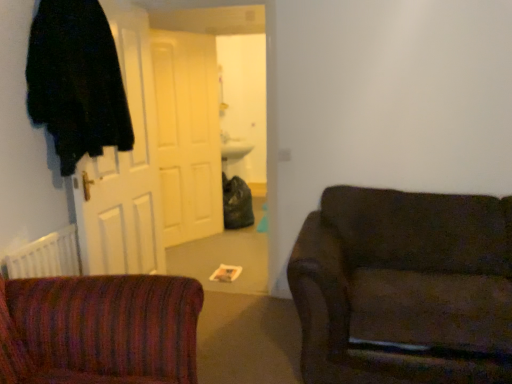
Locate an element on the screen. white wooden door at left, the second door in the back-to-front sequence is located at coordinates (124, 168).

What do you see at coordinates (187, 134) in the screenshot? Image resolution: width=512 pixels, height=384 pixels. I see `white matte door at center, which is the 2th door from front to back` at bounding box center [187, 134].

What is the approximate height of black fuzzy robe at left?

The height of black fuzzy robe at left is 36.57 inches.

Find the location of a particular element. white wooden door at left, positioned as the 1th door in front-to-back order is located at coordinates (124, 168).

Which of these two, dark brown fabric couch at right or white wooden door at left, the second door in the back-to-front sequence, is thinner?

white wooden door at left, the second door in the back-to-front sequence, is thinner.

Is dark brown fabric couch at right positioned with its back to white wooden door at left, the second door in the back-to-front sequence?

No, dark brown fabric couch at right's orientation is not away from white wooden door at left, the second door in the back-to-front sequence.

Is dark brown fabric couch at right with white wooden door at left, positioned as the 1th door in front-to-back order?

No, dark brown fabric couch at right is not touching white wooden door at left, positioned as the 1th door in front-to-back order.

Between dark brown fabric couch at right and white wooden door at left, the second door in the back-to-front sequence, which one has larger size?

Bigger between the two is dark brown fabric couch at right.

Considering the sizes of objects white wooden door at left, positioned as the 1th door in front-to-back order, and dark brown fabric couch at right in the image provided, who is shorter, white wooden door at left, positioned as the 1th door in front-to-back order, or dark brown fabric couch at right?

dark brown fabric couch at right is shorter.

Which object is wider, white wooden door at left, positioned as the 1th door in front-to-back order, or dark brown fabric couch at right?

Wider between the two is dark brown fabric couch at right.

Is white wooden door at left, the second door in the back-to-front sequence, in contact with dark brown fabric couch at right?

No.

Which object is closer to the camera taking this photo, white wooden door at left, positioned as the 1th door in front-to-back order, or dark brown fabric couch at right?

dark brown fabric couch at right.

Is black fuzzy robe at left at the left side of white wooden door at left, positioned as the 1th door in front-to-back order?

Indeed, black fuzzy robe at left is positioned on the left side of white wooden door at left, positioned as the 1th door in front-to-back order.

Is black fuzzy robe at left positioned with its back to white wooden door at left, positioned as the 1th door in front-to-back order?

Correct, black fuzzy robe at left is looking away from white wooden door at left, positioned as the 1th door in front-to-back order.

How distant is black fuzzy robe at left from white wooden door at left, the second door in the back-to-front sequence?

black fuzzy robe at left is 15.91 inches away from white wooden door at left, the second door in the back-to-front sequence.

Looking at their sizes, would you say black fuzzy robe at left is wider or thinner than white wooden door at left, the second door in the back-to-front sequence?

In the image, black fuzzy robe at left appears to be wider than white wooden door at left, the second door in the back-to-front sequence.

From a real-world perspective, who is located higher, black fuzzy robe at left or dark brown fabric couch at right?

black fuzzy robe at left is physically above.

In the scene shown: Between black fuzzy robe at left and dark brown fabric couch at right, which one has smaller width?

Thinner between the two is black fuzzy robe at left.

From the image's perspective, would you say black fuzzy robe at left is positioned over dark brown fabric couch at right?

Indeed, from the image's perspective, black fuzzy robe at left is shown above dark brown fabric couch at right.

Considering the relative positions of black fuzzy robe at left and dark brown fabric couch at right in the image provided, is black fuzzy robe at left to the right of dark brown fabric couch at right from the viewer's perspective?

No.

In the scene shown: Are dark brown fabric couch at right and white matte door at center, which is the first door from back to front, far apart?

dark brown fabric couch at right is far away from white matte door at center, which is the first door from back to front.

Considering the sizes of dark brown fabric couch at right and white matte door at center, which is the 2th door from front to back, in the image, is dark brown fabric couch at right wider or thinner than white matte door at center, which is the 2th door from front to back,?

Clearly, dark brown fabric couch at right has more width compared to white matte door at center, which is the 2th door from front to back.

Between point (358, 196) and point (202, 132), which one is positioned in front?

The point (358, 196) is more forward.

From the image's perspective, relative to white matte door at center, which is the first door from back to front, is white wooden door at left, the second door in the back-to-front sequence, above or below?

Clearly, from the image's perspective, white wooden door at left, the second door in the back-to-front sequence, is below white matte door at center, which is the first door from back to front.

Which of these two, white wooden door at left, the second door in the back-to-front sequence, or white matte door at center, which is the first door from back to front, is bigger?

white wooden door at left, the second door in the back-to-front sequence, is bigger.

Can we say white wooden door at left, the second door in the back-to-front sequence, lies outside white matte door at center, which is the first door from back to front?

That's correct, white wooden door at left, the second door in the back-to-front sequence, is outside of white matte door at center, which is the first door from back to front.

Can you confirm if white matte door at center, which is the 2th door from front to back, is taller than dark brown fabric couch at right?

Indeed, white matte door at center, which is the 2th door from front to back, has a greater height compared to dark brown fabric couch at right.

Which object is closer to the camera taking this photo, white matte door at center, which is the first door from back to front, or dark brown fabric couch at right?

dark brown fabric couch at right is closer to the camera.

The image size is (512, 384). I want to click on door that is the 1st one above the dark brown fabric couch at right (from a real-world perspective), so click(x=187, y=134).

Which object is positioned more to the left, white matte door at center, which is the 2th door from front to back, or dark brown fabric couch at right?

From the viewer's perspective, white matte door at center, which is the 2th door from front to back, appears more on the left side.

This screenshot has width=512, height=384. I want to click on the 1st door above when counting from the dark brown fabric couch at right (from the image's perspective), so click(124, 168).

Locate an element on the screen. This screenshot has width=512, height=384. studio couch in front of the white wooden door at left, the second door in the back-to-front sequence is located at coordinates (404, 288).

When comparing their distances from white wooden door at left, the second door in the back-to-front sequence, does dark brown fabric couch at right or white matte door at center, which is the first door from back to front, seem closer?

white matte door at center, which is the first door from back to front, lies closer to white wooden door at left, the second door in the back-to-front sequence, than the other object.

Estimate the real-world distances between objects in this image. Which object is closer to black fuzzy robe at left, white wooden door at left, positioned as the 1th door in front-to-back order, or dark brown fabric couch at right?

white wooden door at left, positioned as the 1th door in front-to-back order, is closer to black fuzzy robe at left.

When comparing their distances from black fuzzy robe at left, does dark brown fabric couch at right or white wooden door at left, the second door in the back-to-front sequence, seem further?

The object further to black fuzzy robe at left is dark brown fabric couch at right.

When comparing their distances from black fuzzy robe at left, does white matte door at center, which is the 2th door from front to back, or white wooden door at left, the second door in the back-to-front sequence, seem further?

white matte door at center, which is the 2th door from front to back, lies further to black fuzzy robe at left than the other object.

When comparing their distances from white matte door at center, which is the 2th door from front to back, does dark brown fabric couch at right or black fuzzy robe at left seem closer?

black fuzzy robe at left is closer to white matte door at center, which is the 2th door from front to back.

When comparing their distances from white matte door at center, which is the 2th door from front to back, does white wooden door at left, the second door in the back-to-front sequence, or dark brown fabric couch at right seem closer?

Among the two, white wooden door at left, the second door in the back-to-front sequence, is located nearer to white matte door at center, which is the 2th door from front to back.

Based on their spatial positions, is black fuzzy robe at left or white matte door at center, which is the first door from back to front, further from white wooden door at left, positioned as the 1th door in front-to-back order?

The object further to white wooden door at left, positioned as the 1th door in front-to-back order, is white matte door at center, which is the first door from back to front.

When comparing their distances from black fuzzy robe at left, does white wooden door at left, positioned as the 1th door in front-to-back order, or white matte door at center, which is the 2th door from front to back, seem closer?

white wooden door at left, positioned as the 1th door in front-to-back order, is positioned closer to the anchor black fuzzy robe at left.

Locate an element on the screen. The height and width of the screenshot is (384, 512). door between dark brown fabric couch at right and white matte door at center, which is the 2th door from front to back, along the z-axis is located at coordinates (124, 168).

I want to click on door between black fuzzy robe at left and white matte door at center, which is the first door from back to front, along the z-axis, so click(x=124, y=168).

The height and width of the screenshot is (384, 512). In order to click on robe between dark brown fabric couch at right and white matte door at center, which is the first door from back to front, from front to back in this screenshot , I will do `click(76, 81)`.